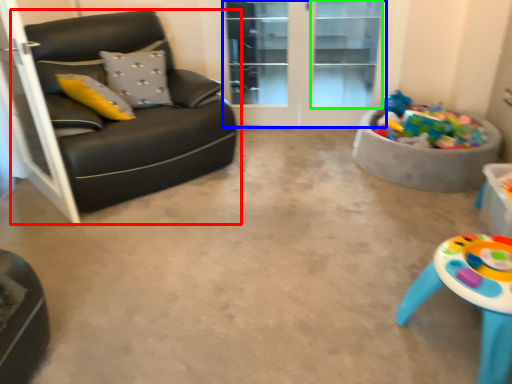
Question: Which object is the closest to the studio couch (highlighted by a red box)? Choose among these: glass door (highlighted by a blue box) or window (highlighted by a green box).

Choices:
 (A) glass door
 (B) window

Answer: (A)